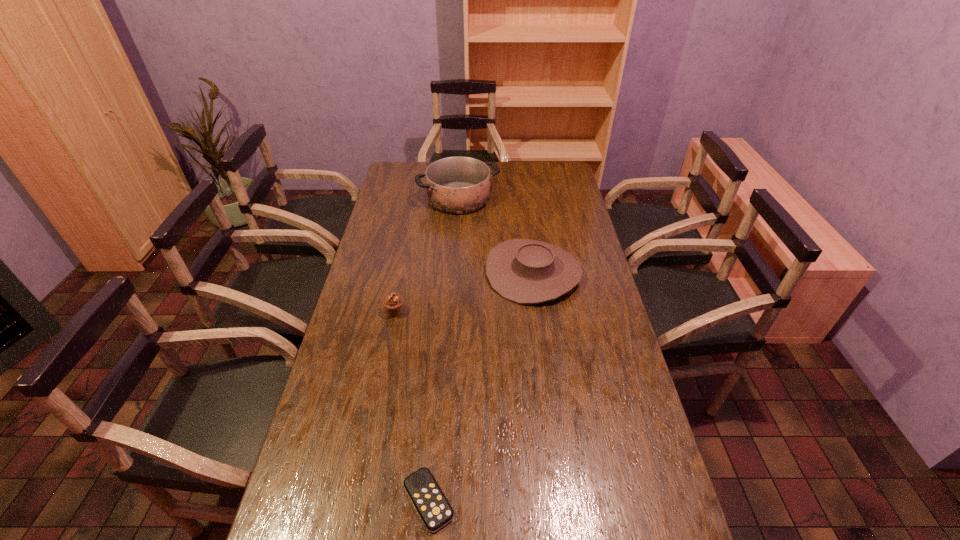
Identify the location of object positioned at the far edge. Image resolution: width=960 pixels, height=540 pixels. (458, 185).

I want to click on saucepan positioned at the left edge, so click(458, 185).

Locate an element on the screen. muffin located in the left edge section of the desktop is located at coordinates (392, 303).

Where is `object present at the right edge`? object present at the right edge is located at coordinates (525, 271).

What are the coordinates of `object that is at the far left corner` in the screenshot? It's located at (458, 185).

The image size is (960, 540). In the image, there is a desktop. In order to click on free space at the left edge in this screenshot , I will do `click(339, 422)`.

What are the coordinates of `free space at the right edge of the desktop` in the screenshot? It's located at [670, 500].

Where is `free space at the far left corner of the desktop`? free space at the far left corner of the desktop is located at coordinates (391, 168).

This screenshot has height=540, width=960. In the image, there is a desktop. Identify the location of vacant space at the far right corner. (574, 186).

What are the coordinates of `free space between the nearest object and the cowboy hat` in the screenshot? It's located at (481, 387).